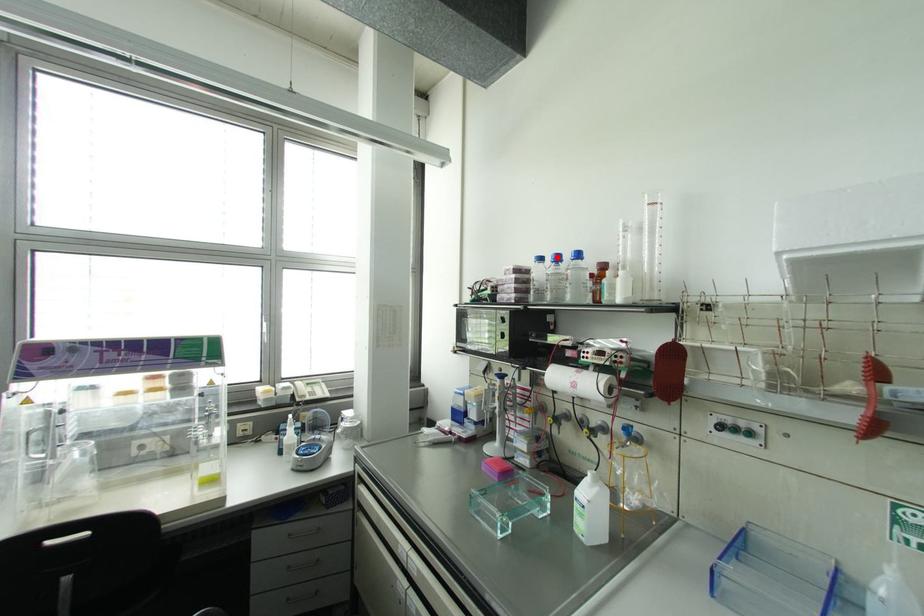
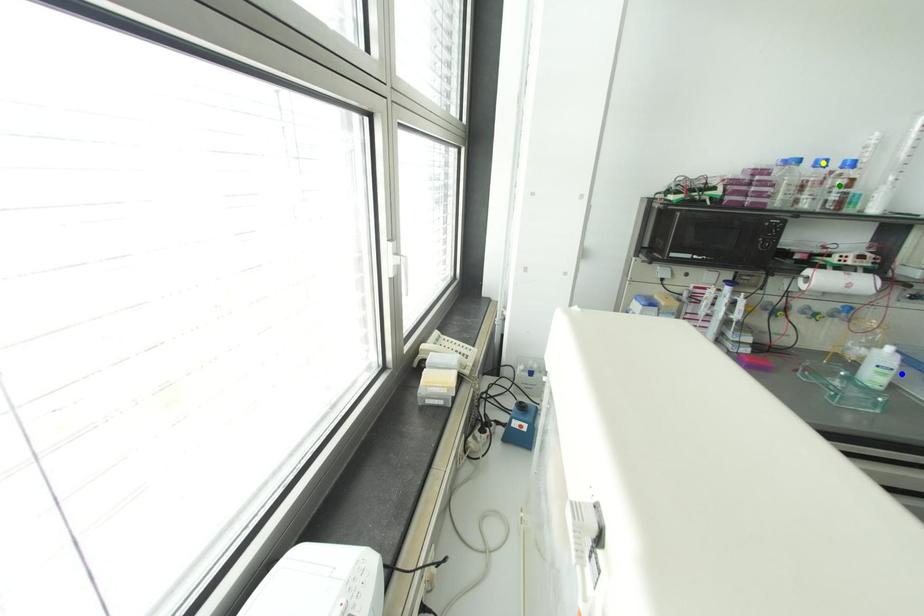
Question: I am providing you with two images of the same scene from different viewpoints. A red point is marked on the first image. You are given multiple points on the second image. Which point in image 2 is actually the same real-world point as the red point in image 1?

Choices:
 (A) yellow point
 (B) green point
 (C) blue point

Answer: (A)